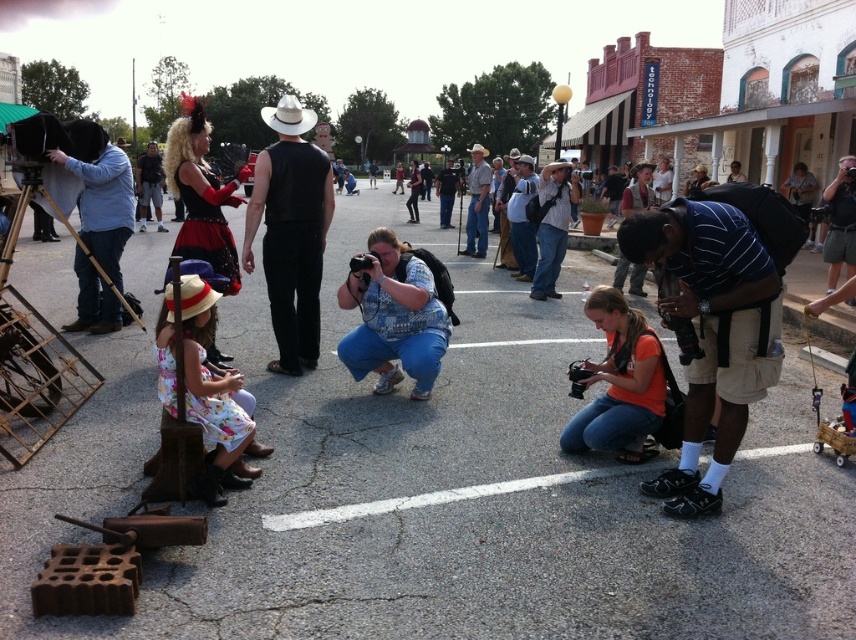
Question: Estimate the real-world distances between objects in this image. Which object is farther from the blue denim jeans at center?

Choices:
 (A) denim jeans at center
 (B) leather jacket at center

Answer: (A)

Question: Which point appears closest to the camera in this image?

Choices:
 (A) (260, 108)
 (B) (474, 230)

Answer: (B)

Question: Does leather jacket at center have a smaller size compared to matte black camera at center?

Choices:
 (A) yes
 (B) no

Answer: (B)

Question: Which of these objects is positioned farthest from the leather jacket at center?

Choices:
 (A) matte black camera at center
 (B) floral cotton dress at center
 (C) denim jeans at center

Answer: (B)

Question: Can you confirm if striped cotton shirt at lower right is wider than floral cotton dress at center?

Choices:
 (A) no
 (B) yes

Answer: (B)

Question: Does orange fabric camera at lower center have a greater width compared to denim jeans at center?

Choices:
 (A) yes
 (B) no

Answer: (A)